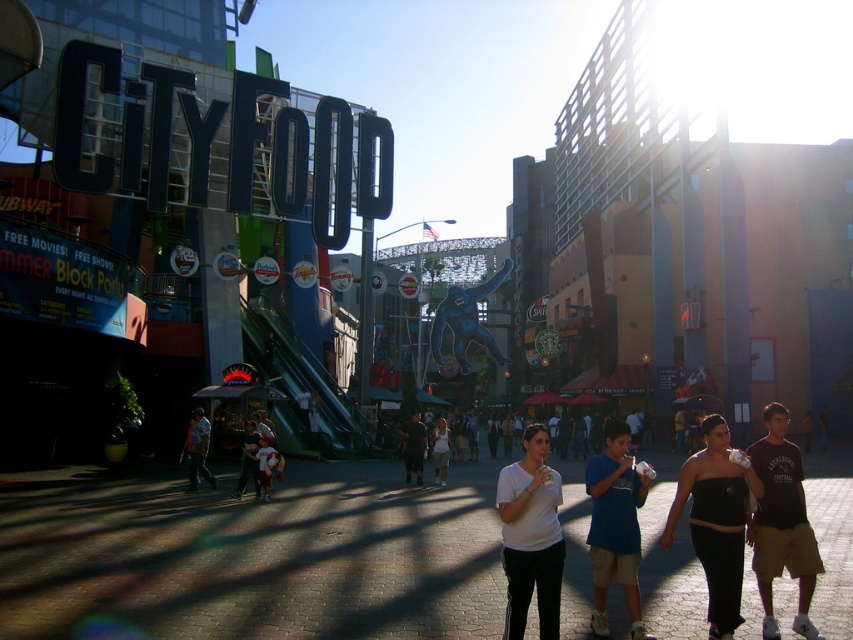
You are a photographer standing in the middle of the paved area in the foreground of the CityFood district. You notice two people wearing a black strapless dress at center and a white matte shirt at center. Which clothing item is positioned higher in the image?

The black strapless dress at center is located above the white matte shirt at center, so it is positioned higher in the image.

You are a photographer standing in the middle of CityFood district. You see the matte black sign at center and the brown leather jacket at center. Which object is closer to the camera?

The matte black sign at center is closer to the camera because it is positioned over the brown leather jacket at center.